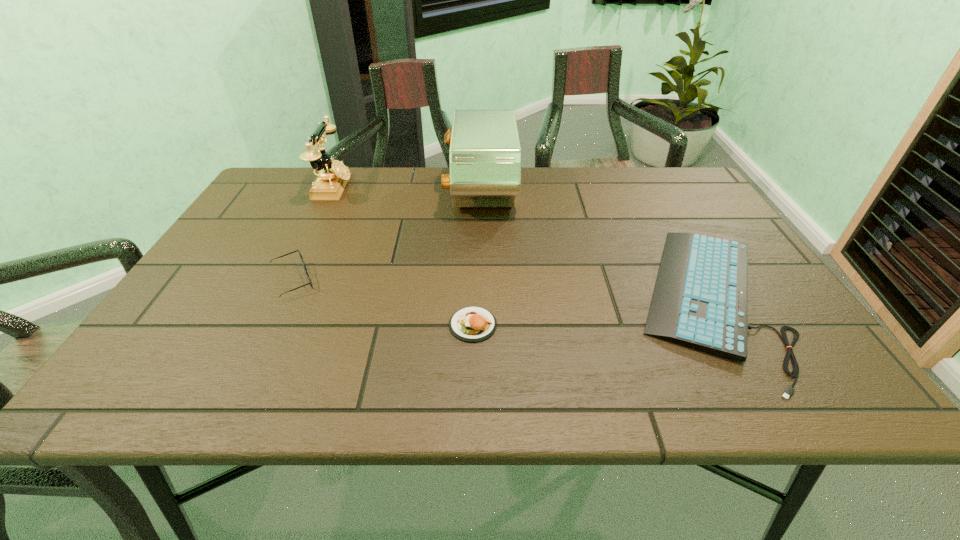
The height and width of the screenshot is (540, 960). In order to click on vacant region at the left edge in this screenshot , I will do `click(243, 300)`.

This screenshot has width=960, height=540. I want to click on blank space at the right edge, so point(703,223).

In the image, there is a desktop. At what (x,y) coordinates should I click in order to perform the action: click on vacant space at the far left corner. Please return your answer as a coordinate pair (x, y). The image size is (960, 540). Looking at the image, I should click on (275, 180).

Locate an element on the screen. The height and width of the screenshot is (540, 960). vacant space at the near left corner of the desktop is located at coordinates (157, 396).

At what (x,y) coordinates should I click in order to perform the action: click on vacant space at the far right corner of the desktop. Please return your answer as a coordinate pair (x, y). Looking at the image, I should click on (666, 203).

Find the location of `free point between the patty (food) and the telephone`. free point between the patty (food) and the telephone is located at coordinates tap(403, 256).

Image resolution: width=960 pixels, height=540 pixels. I want to click on empty location between the third tallest object and the patty (food), so click(383, 303).

At what (x,y) coordinates should I click in order to perform the action: click on free space between the telephone and the third tallest object. Please return your answer as a coordinate pair (x, y). Looking at the image, I should click on (313, 234).

Where is `free space between the computer keyboard and the third shortest object`? free space between the computer keyboard and the third shortest object is located at coordinates (499, 291).

This screenshot has height=540, width=960. In order to click on free space between the patty (food) and the toaster oven in this screenshot , I will do `click(477, 258)`.